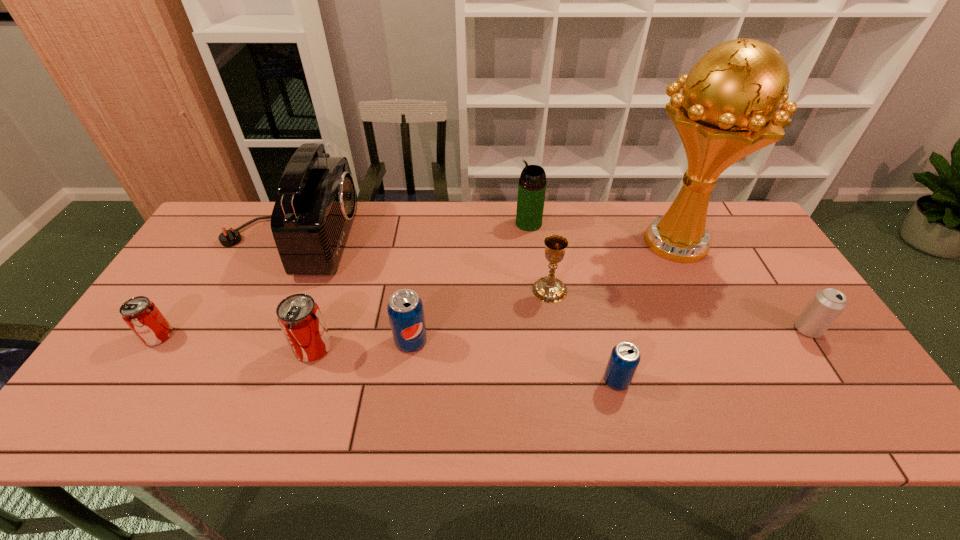
Locate an element on the screen. The height and width of the screenshot is (540, 960). vacant area at the right edge is located at coordinates (745, 263).

Identify the location of free space at the far right corner of the desktop. (719, 226).

In the image, there is a desktop. At what (x,y) coordinates should I click in order to perform the action: click on vacant space at the near right corner. Please return your answer as a coordinate pair (x, y). Looking at the image, I should click on [862, 423].

Locate an element on the screen. free space between the leftmost pop soda and the gold trophy_cup is located at coordinates (416, 289).

This screenshot has width=960, height=540. I want to click on vacant space that is in between the leftmost pop soda and the beer can, so click(483, 333).

The image size is (960, 540). Find the location of `vacant space that is in between the radio receiver and the seventh shortest object`. vacant space that is in between the radio receiver and the seventh shortest object is located at coordinates (408, 231).

Where is `empty location between the chalice and the leftmost pop soda`? The height and width of the screenshot is (540, 960). empty location between the chalice and the leftmost pop soda is located at coordinates (354, 313).

Locate an element on the screen. vacant space in between the second object from right to left and the green thermos bottle is located at coordinates (601, 233).

I want to click on free spot between the eighth shortest object and the smaller blue pop soda, so click(x=452, y=309).

Find the location of `vacant point located between the chalice and the left red pop soda`. vacant point located between the chalice and the left red pop soda is located at coordinates (354, 313).